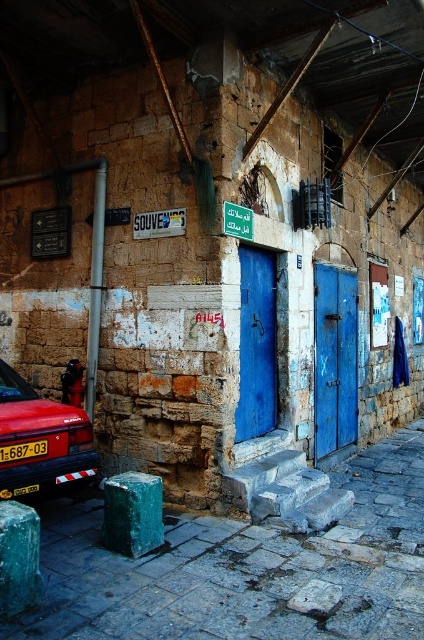
Question: Does shiny red car at lower left have a lesser width compared to green textured block at lower center?

Choices:
 (A) no
 (B) yes

Answer: (A)

Question: Among these objects, which one is farthest from the camera?

Choices:
 (A) blue painted wood door at center
 (B) shiny red car at lower left
 (C) green textured block at lower center

Answer: (A)

Question: Which point is closer to the camera?

Choices:
 (A) (412, 442)
 (B) (265, 328)
 (C) (42, 445)
 (D) (36, 483)

Answer: (D)

Question: Considering the real-world distances, which object is closest to the green plastic sign at upper center?

Choices:
 (A) blue matte door at center
 (B) green textured block at lower center

Answer: (A)

Question: Observing the image, what is the correct spatial positioning of smooth concrete steps at lower center in reference to blue matte door at center?

Choices:
 (A) above
 (B) below

Answer: (B)

Question: Does blue painted wood door at center appear under yellow plastic license plate at lower left?

Choices:
 (A) yes
 (B) no

Answer: (B)